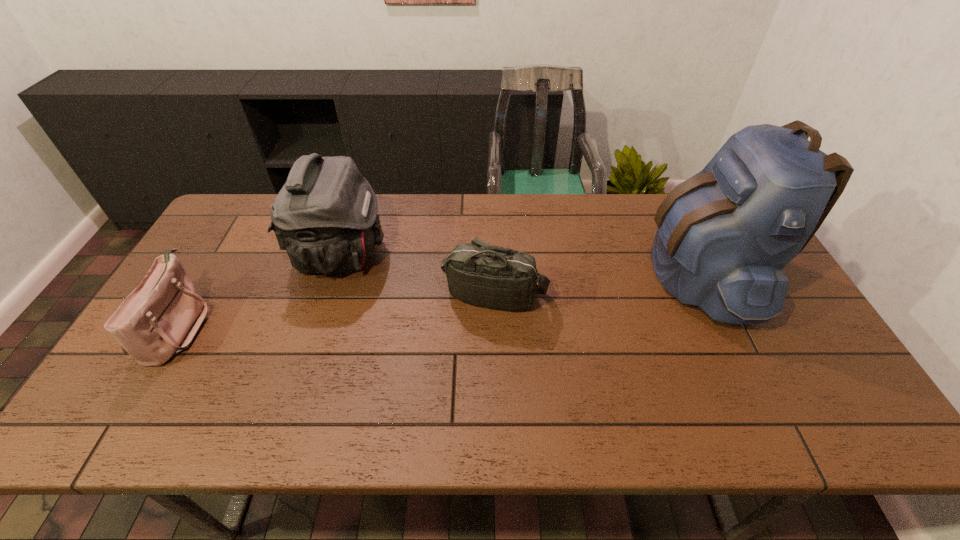
Image resolution: width=960 pixels, height=540 pixels. Find the location of `blank region between the shortest shoulder bag and the rightmost shoulder bag`. blank region between the shortest shoulder bag and the rightmost shoulder bag is located at coordinates (337, 310).

Where is `free space between the shortest shoulder bag and the tallest object`? The width and height of the screenshot is (960, 540). free space between the shortest shoulder bag and the tallest object is located at coordinates 440,300.

Select which object is the third closest to the rightmost object. Please provide its 2D coordinates. Your answer should be formatted as a tuple, i.e. [(x, y)], where the tuple contains the x and y coordinates of a point satisfying the conditions above.

[(158, 319)]

The image size is (960, 540). I want to click on object that is the closest one to the leftmost object, so click(x=325, y=216).

At what (x,y) coordinates should I click in order to perform the action: click on the second closest shoulder bag to the leftmost object. Please return your answer as a coordinate pair (x, y). The image size is (960, 540). Looking at the image, I should click on (478, 273).

Identify which shoulder bag is the nearest to the backpack. Please provide its 2D coordinates. Your answer should be formatted as a tuple, i.e. [(x, y)], where the tuple contains the x and y coordinates of a point satisfying the conditions above.

[(478, 273)]

I want to click on vacant position in the image that satisfies the following two spatial constraints: 1. at the front pocket of the rightmost object; 2. at the front padded panel of the second shortest object, so click(710, 295).

Where is `vacant space that satisfies the following two spatial constraints: 1. at the front padded panel of the third object from left to right; 2. on the front pocket of the shortest shoulder bag`? This screenshot has height=540, width=960. vacant space that satisfies the following two spatial constraints: 1. at the front padded panel of the third object from left to right; 2. on the front pocket of the shortest shoulder bag is located at coordinates (496, 326).